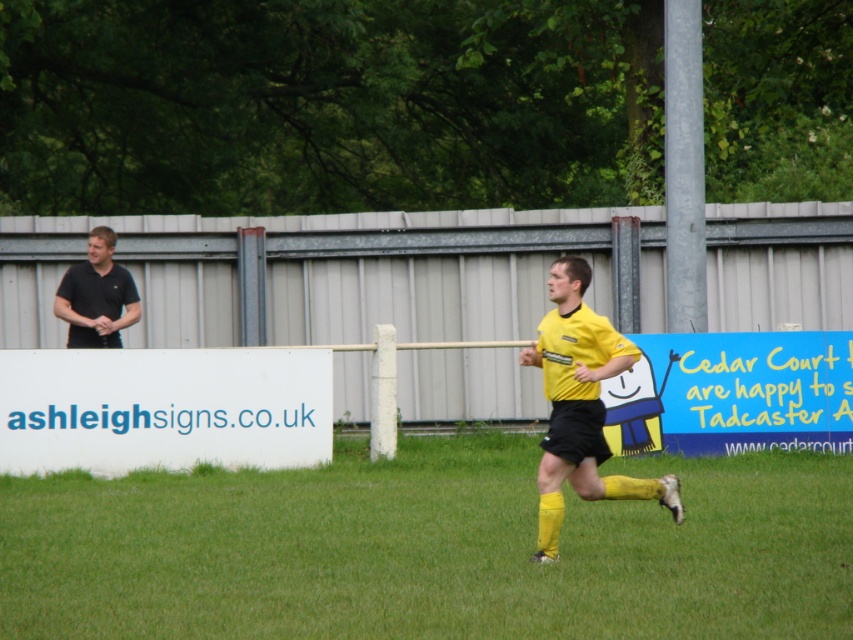
In the scene shown: Which is more to the right, green grass at center or yellow matte jersey at center?

From the viewer's perspective, yellow matte jersey at center appears more on the right side.

Is green grass at center positioned behind yellow matte jersey at center?

Yes.

What do you see at coordinates (428, 548) in the screenshot? This screenshot has width=853, height=640. I see `green grass at center` at bounding box center [428, 548].

Where is `green grass at center`? This screenshot has height=640, width=853. green grass at center is located at coordinates click(428, 548).

Is point (50, 600) less distant than point (115, 280)?

That is True.

Consider the image. Does green grass at center appear on the right side of black smooth shirt at left?

Indeed, green grass at center is positioned on the right side of black smooth shirt at left.

Describe the element at coordinates (428, 548) in the screenshot. This screenshot has height=640, width=853. I see `green grass at center` at that location.

Locate an element on the screen. green grass at center is located at coordinates (428, 548).

Which is more to the right, yellow matte jersey at center or black smooth shirt at left?

yellow matte jersey at center

At what (x,y) coordinates should I click in order to perform the action: click on yellow matte jersey at center. Please return your answer as a coordinate pair (x, y). The height and width of the screenshot is (640, 853). Looking at the image, I should click on [579, 404].

Where is `yellow matte jersey at center`? yellow matte jersey at center is located at coordinates (579, 404).